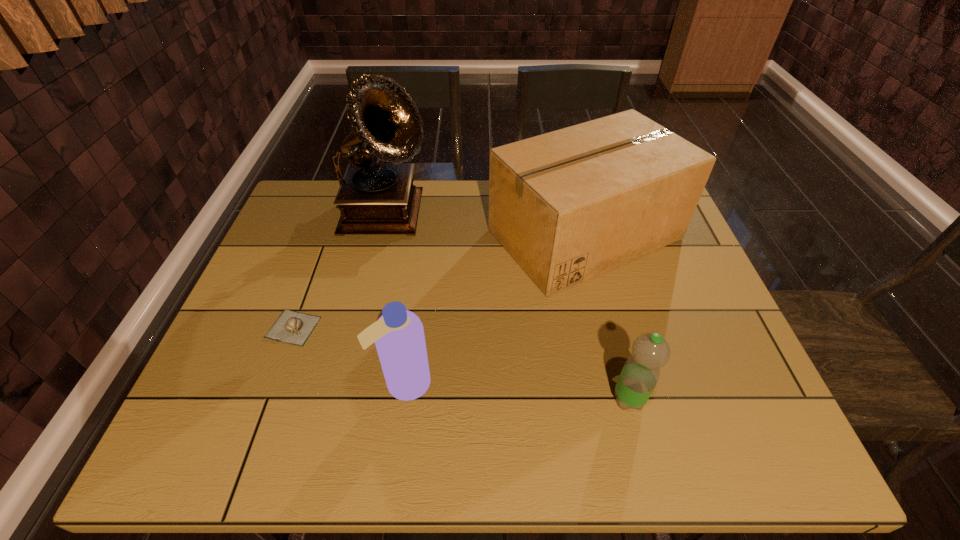
The image size is (960, 540). I want to click on free spot that satisfies the following two spatial constraints: 1. on the front side of the shampoo; 2. on the left side of the third nearest object, so click(273, 383).

At what (x,y) coordinates should I click in order to perform the action: click on free space that satisfies the following two spatial constraints: 1. on the horn of the shampoo; 2. on the left side of the record player. Please return your answer as a coordinate pair (x, y). Looking at the image, I should click on (348, 383).

This screenshot has height=540, width=960. I want to click on free space that satisfies the following two spatial constraints: 1. on the front side of the second shortest object; 2. on the right side of the shampoo, so click(401, 399).

Locate an element on the screen. vacant region that satisfies the following two spatial constraints: 1. on the horn of the tallest object; 2. on the left side of the shampoo is located at coordinates (348, 383).